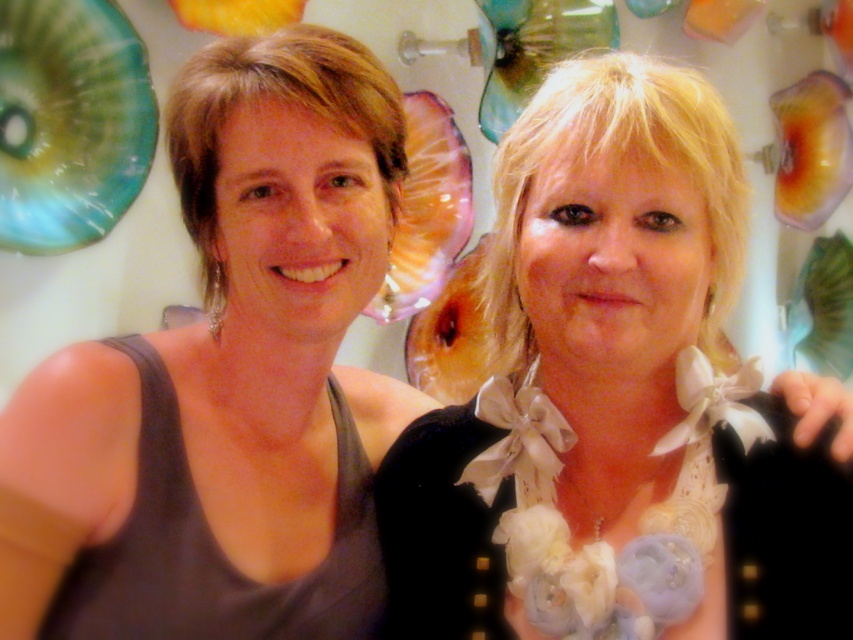
Can you confirm if white satin bow at right is positioned below matte black tank top at left?

Indeed, white satin bow at right is positioned under matte black tank top at left.

Between white satin bow at right and matte black tank top at left, which one has more height?

Standing taller between the two is matte black tank top at left.

This screenshot has height=640, width=853. Identify the location of white satin bow at right. (619, 400).